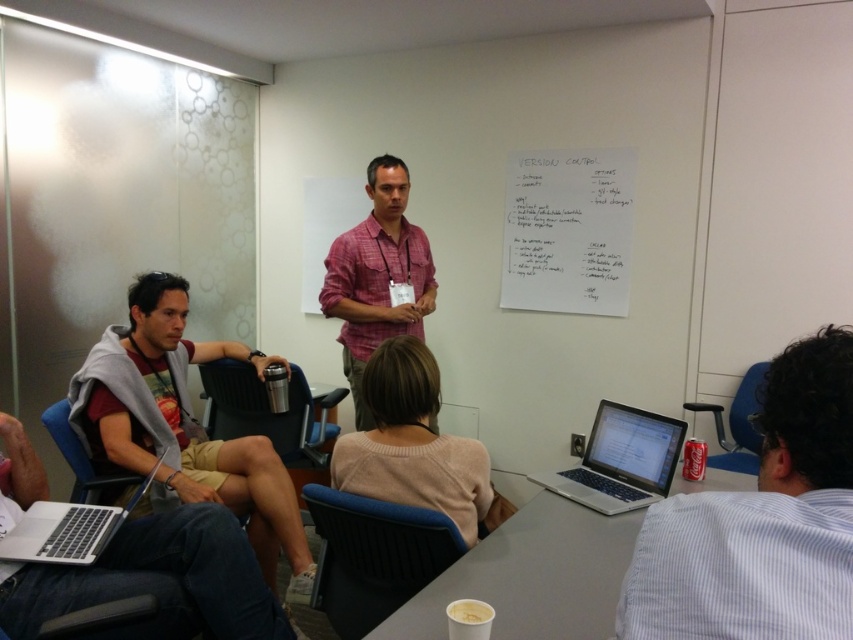
Question: Which of the following is the farthest from the observer?

Choices:
 (A) silver metallic laptop at lower center
 (B) metallic/black chair at lower left
 (C) whiteboard at upper center

Answer: (C)

Question: Which object is positioned closest to the white plastic table at lower center?

Choices:
 (A) metallic/black chair at lower left
 (B) white striped shirt at lower right

Answer: (B)

Question: Which point is closer to the camera?

Choices:
 (A) silver metallic laptop at lower left
 (B) white plastic table at lower center

Answer: (B)

Question: Is matte gray hoodie at left below plaid cotton shirt at center?

Choices:
 (A) no
 (B) yes

Answer: (B)

Question: Can you confirm if white striped shirt at lower right is positioned to the left of blue plastic chair at lower right?

Choices:
 (A) no
 (B) yes

Answer: (B)

Question: Is white plastic table at lower center bigger than light beige sweater at center?

Choices:
 (A) yes
 (B) no

Answer: (A)